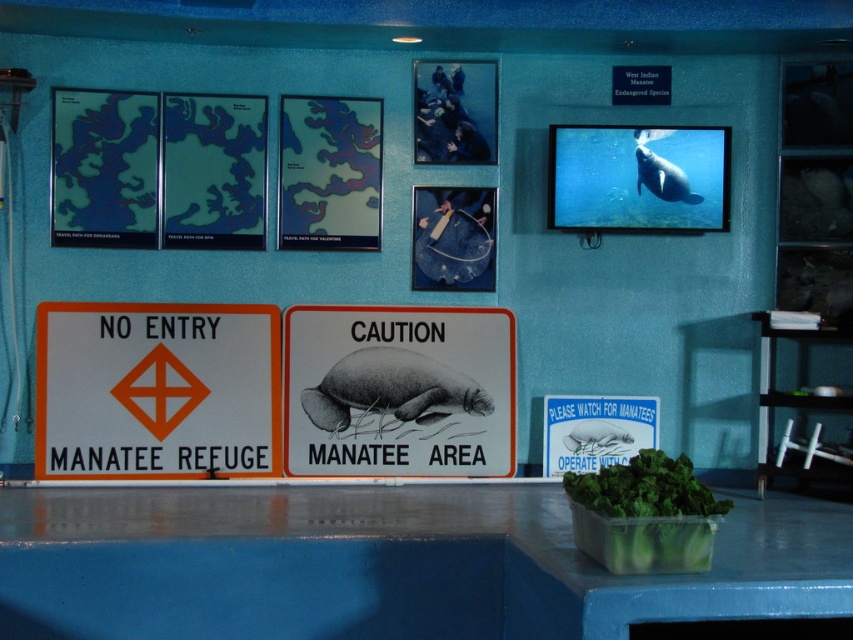
You are standing in the manatee exhibit and want to touch the wall where the point is located. The maximum reach of your arm is 2 feet. Can you reach the point at point (352, 364) with your arm?

The distance between you and the point at point (352, 364) is 16.53 feet, which is much greater than your 2 feet arm reach. You cannot reach it.

You are an educator preparing a presentation about manatees. You have a white paper with black ink at center and a gray rubber manatee at center on your desk. You need to place them on a display board so that they are exactly 30 inches apart. Can you place them as required?

The white paper with black ink at center and gray rubber manatee at center are 30.17 inches apart, which is slightly more than 30 inches. Therefore, you can adjust their positions to meet the 30 inches requirement by moving them closer together by 0.17 inches.